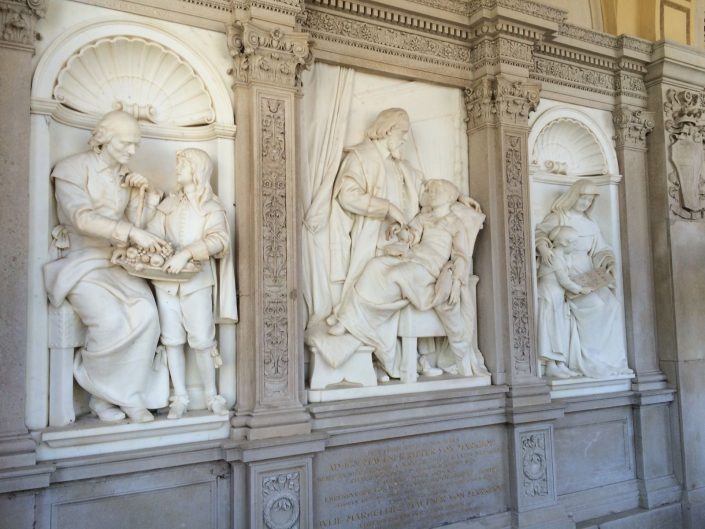
I want to click on 1 fruit basket, so click(157, 267).